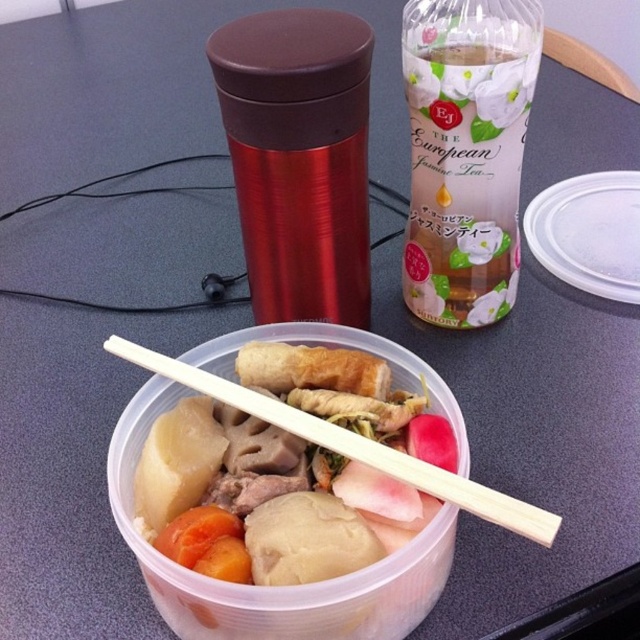
Which of these two, metallic red thermos at upper center or wooden chopsticks at center, stands shorter?

wooden chopsticks at center is shorter.

Which is in front, point (353, 157) or point (262, 419)?

Point (262, 419) is in front.

Locate an element on the screen. The image size is (640, 640). metallic red thermos at upper center is located at coordinates (300, 157).

Between point (513, 264) and point (209, 385), which one is positioned behind?

Positioned behind is point (513, 264).

Where is `white paper bottle at upper center`? white paper bottle at upper center is located at coordinates (465, 152).

What do you see at coordinates (300, 157) in the screenshot?
I see `metallic red thermos at upper center` at bounding box center [300, 157].

The height and width of the screenshot is (640, 640). What do you see at coordinates (300, 157) in the screenshot?
I see `metallic red thermos at upper center` at bounding box center [300, 157].

Image resolution: width=640 pixels, height=640 pixels. What are the coordinates of `metallic red thermos at upper center` in the screenshot? It's located at (300, 157).